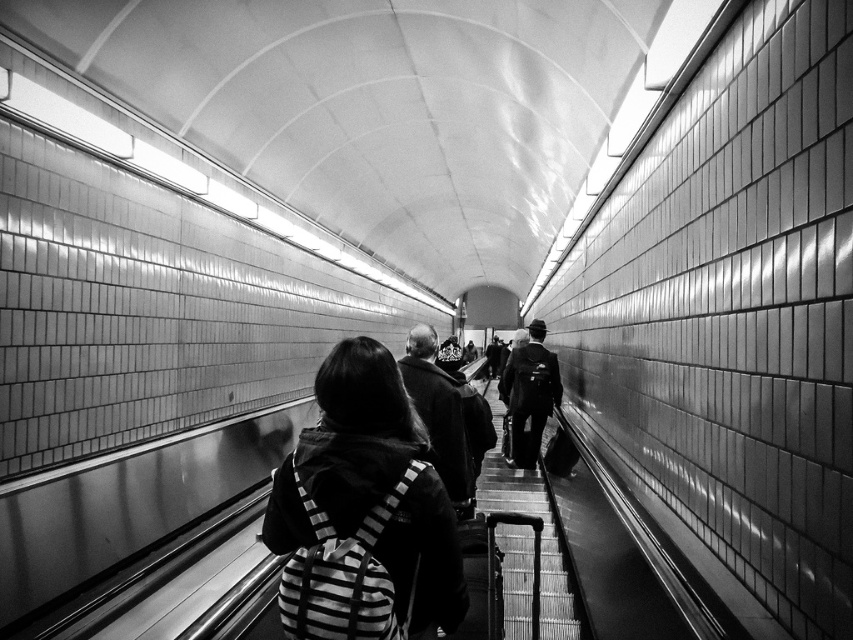
You are a photographer trying to capture a candid shot of the two people in the subway station. You want to ensure that both the striped fabric backpack at center and the dark wool coat at center are clearly visible in the frame. Given their sizes, which object should you focus on first to ensure it doesn,t get cropped out?

The dark wool coat at center occupies more space than the striped fabric backpack at center, so you should focus on ensuring the dark wool coat at center is fully in frame first to prevent it from being cropped out.

You are a designer trying to fit both the striped fabric backpack at center and the dark wool coat at center into a storage compartment. The compartment can only accommodate items narrower than the coat. Can the backpack fit?

The striped fabric backpack at center has a width less than the dark wool coat at center, so it can fit into the storage compartment as it is narrower than the coat.

Consider the image. You are a photographer trying to capture the striped fabric backpack at center and the dark gray suit at center in the same frame. Can you tell me which object is covering part of the other?

The striped fabric backpack at center is positioned over the dark gray suit at center, so it is covering part of it.